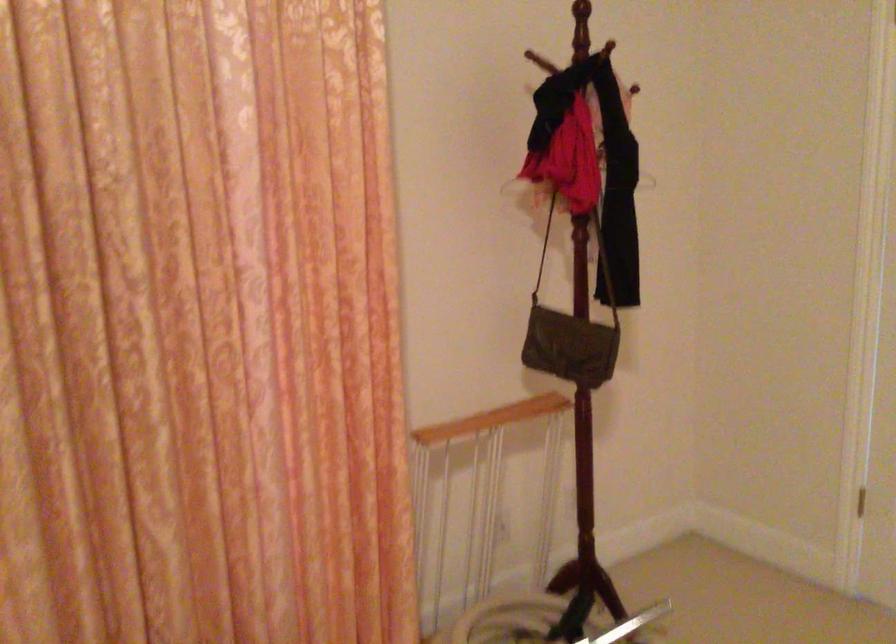
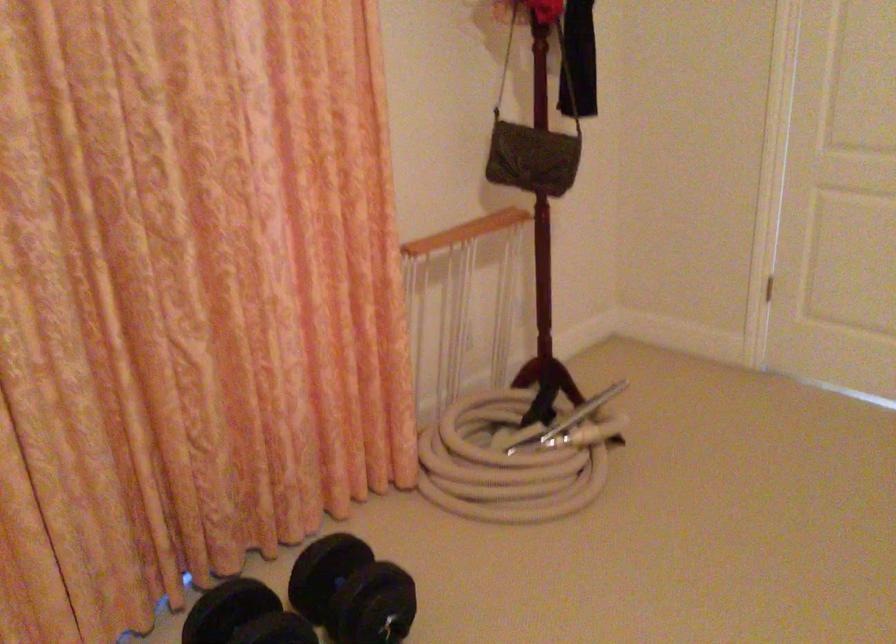
Question: What movement of the cameraman would produce the second image?

Choices:
 (A) Left
 (B) Right
 (C) Forward
 (D) Backward

Answer: (A)